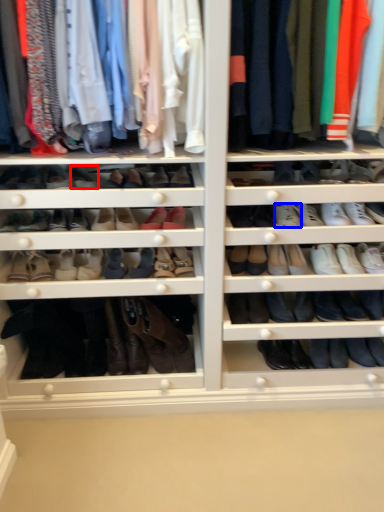
Question: Among these objects, which one is farthest to the camera, shoe (highlighted by a red box) or shoe (highlighted by a blue box)?

Choices:
 (A) shoe
 (B) shoe

Answer: (B)